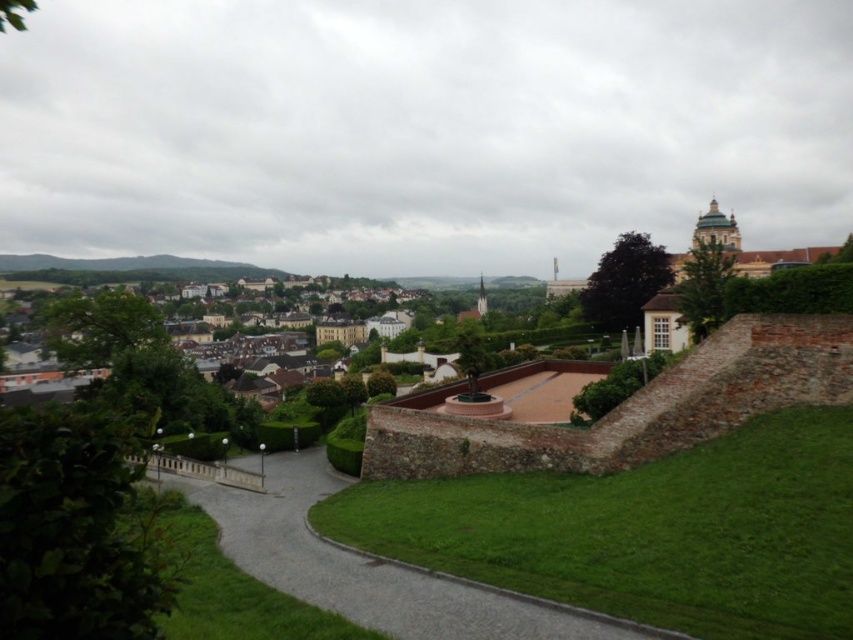
Question: Can you confirm if paved stone path at lower center is positioned above brown stone buildings at center?

Choices:
 (A) no
 (B) yes

Answer: (A)

Question: Considering the relative positions of paved stone path at lower center and brown stone buildings at center in the image provided, where is paved stone path at lower center located with respect to brown stone buildings at center?

Choices:
 (A) below
 (B) above

Answer: (A)

Question: Among these points, which one is farthest from the camera?

Choices:
 (A) (318, 326)
 (B) (224, 518)

Answer: (A)

Question: Which point is closer to the camera taking this photo?

Choices:
 (A) (190, 355)
 (B) (250, 506)

Answer: (B)

Question: Does paved stone path at lower center have a smaller size compared to brown stone buildings at center?

Choices:
 (A) yes
 (B) no

Answer: (A)